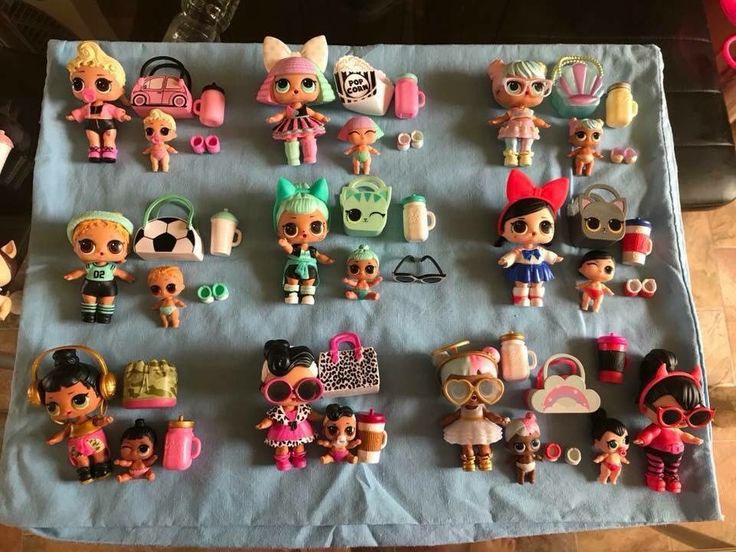
This screenshot has width=736, height=552. In order to click on drinking glasses in this screenshot , I will do `click(372, 443)`, `click(183, 443)`, `click(221, 236)`, `click(212, 108)`, `click(406, 97)`, `click(414, 211)`, `click(605, 355)`, `click(514, 357)`, `click(639, 242)`, `click(618, 108)`.